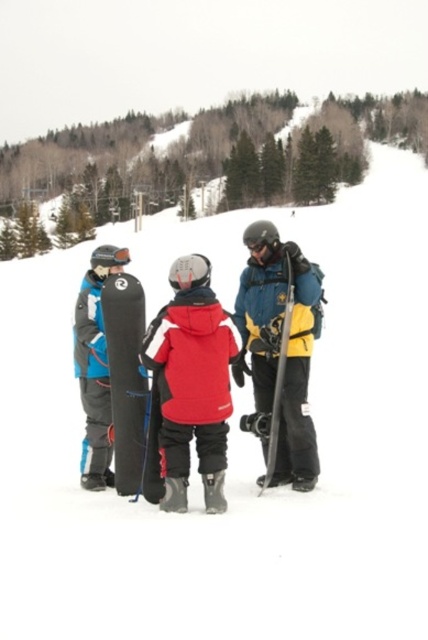
Question: Is matte red jacket at center closer to the viewer compared to matte black snowboard at center?

Choices:
 (A) yes
 (B) no

Answer: (A)

Question: Can you confirm if matte red jacket at center is smaller than matte black snowboard at center?

Choices:
 (A) no
 (B) yes

Answer: (A)

Question: Which point is closer to the camera?

Choices:
 (A) (278, 308)
 (B) (276, 396)

Answer: (B)

Question: Is black matte snowboard at center above matte black snowboard at center?

Choices:
 (A) no
 (B) yes

Answer: (A)

Question: Which object is the closest to the black matte snowboard at center?

Choices:
 (A) matte black snowboard at center
 (B) matte blue snowboard at right

Answer: (B)

Question: Which point is farther to the camera?

Choices:
 (A) (133, 416)
 (B) (279, 385)

Answer: (B)